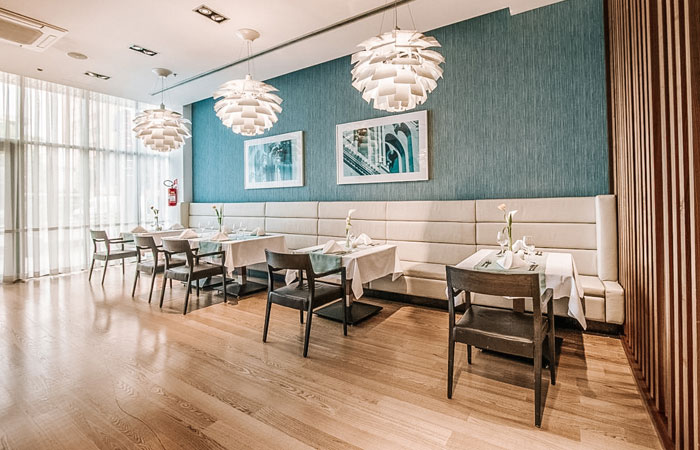
Image resolution: width=700 pixels, height=450 pixels. I want to click on chairs, so click(x=108, y=248), click(x=147, y=265), click(x=175, y=274), click(x=295, y=296), click(x=477, y=341).